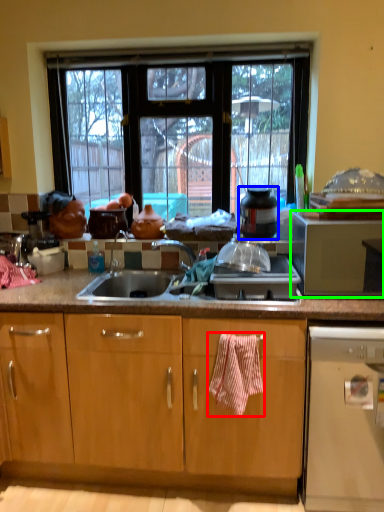
Question: Which object is positioned farthest from blanket (highlighted by a red box)? Select from appliance (highlighted by a blue box) and microwave oven (highlighted by a green box).

Choices:
 (A) appliance
 (B) microwave oven

Answer: (B)